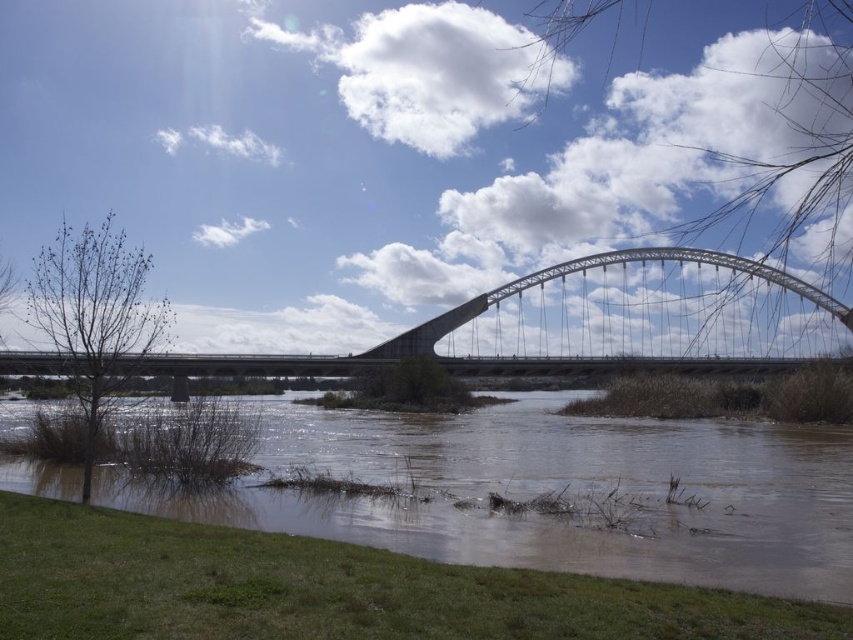
Question: Which of the following is the closest to the observer?

Choices:
 (A) brown muddy water at lower center
 (B) metallic gray arch bridge at center

Answer: (A)

Question: Does brown muddy water at lower center have a larger size compared to metallic gray arch bridge at center?

Choices:
 (A) no
 (B) yes

Answer: (A)

Question: Which object appears closest to the camera in this image?

Choices:
 (A) brown muddy water at lower center
 (B) metallic gray arch bridge at center

Answer: (A)

Question: Does brown muddy water at lower center have a larger size compared to metallic gray arch bridge at center?

Choices:
 (A) no
 (B) yes

Answer: (A)

Question: Is brown muddy water at lower center below metallic gray arch bridge at center?

Choices:
 (A) yes
 (B) no

Answer: (A)

Question: Among these objects, which one is farthest from the camera?

Choices:
 (A) brown muddy water at lower center
 (B) metallic gray arch bridge at center

Answer: (B)